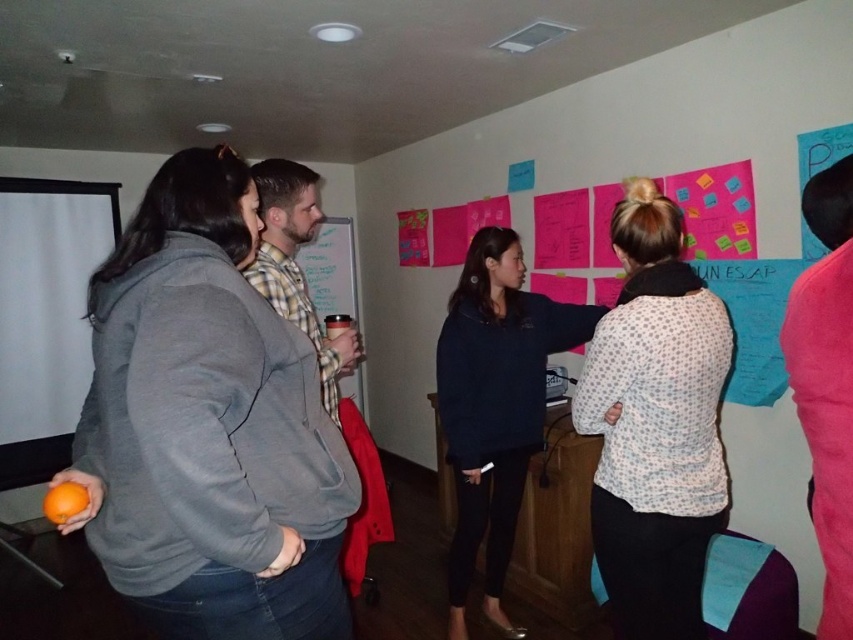
You are a GUI agent. You are given a task and a screenshot of the screen. Output one action in this format:
    pyautogui.click(x=<x>, y=<y>)
    Task: Click on the dark blue sweater at center
    
    Given the screenshot: What is the action you would take?
    pyautogui.click(x=495, y=404)

Who is more distant from viewer, (502, 579) or (62, 481)?

Point (502, 579)

You are a GUI agent. You are given a task and a screenshot of the screen. Output one action in this format:
    pyautogui.click(x=<x>, y=<y>)
    Task: Click on the dark blue sweater at center
    The height and width of the screenshot is (640, 853).
    Given the screenshot: What is the action you would take?
    pyautogui.click(x=495, y=404)

Which of these two, white dotted shirt at center or matte plastic cup at center, stands taller?

With more height is white dotted shirt at center.

From the picture: Can you confirm if white dotted shirt at center is smaller than matte plastic cup at center?

No, white dotted shirt at center is not smaller than matte plastic cup at center.

At what (x,y) coordinates should I click in order to perform the action: click on white dotted shirt at center. Please return your answer as a coordinate pair (x, y). Image resolution: width=853 pixels, height=640 pixels. Looking at the image, I should click on (654, 422).

This screenshot has width=853, height=640. Identify the location of white dotted shirt at center. (654, 422).

Find the location of a particular element. Image resolution: width=853 pixels, height=640 pixels. matte gray hoodie at left is located at coordinates (207, 426).

The width and height of the screenshot is (853, 640). I want to click on matte gray hoodie at left, so click(207, 426).

The height and width of the screenshot is (640, 853). I want to click on matte gray hoodie at left, so click(207, 426).